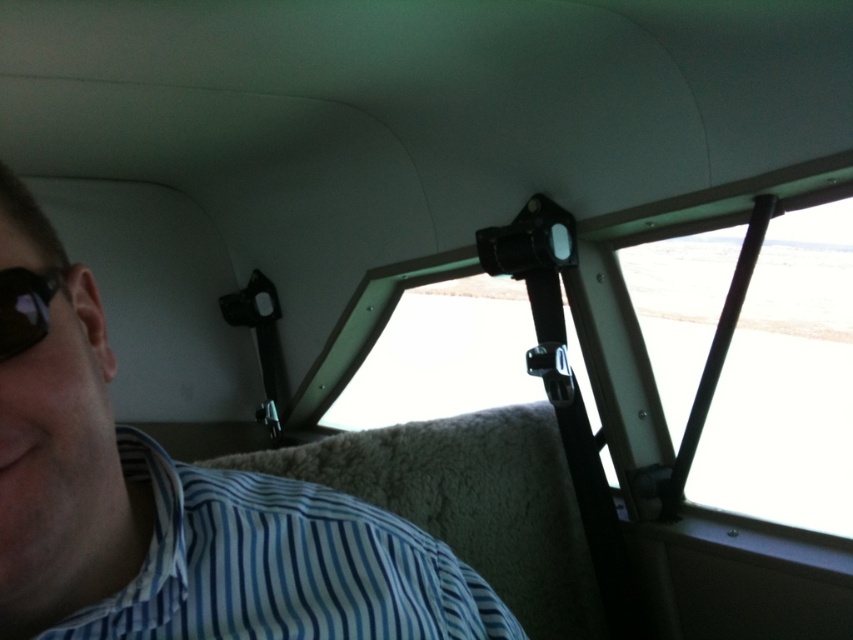
Question: Among these points, which one is nearest to the camera?

Choices:
 (A) (27, 340)
 (B) (347, 531)
 (C) (761, 445)

Answer: (A)

Question: Which object appears closest to the camera in this image?

Choices:
 (A) blue striped fabric shirt at lower left
 (B) transparent plastic window at upper center
 (C) black matte goggles at left
 (D) blue striped shirt at upper left

Answer: (D)

Question: From the image, what is the correct spatial relationship of blue striped shirt at upper left in relation to black matte goggles at left?

Choices:
 (A) above
 (B) below

Answer: (B)

Question: Which is nearer to the transparent plastic window at upper center?

Choices:
 (A) blue striped fabric shirt at lower left
 (B) blue striped shirt at upper left

Answer: (B)

Question: Is transparent plastic window at upper center positioned at the back of blue striped fabric shirt at lower left?

Choices:
 (A) no
 (B) yes

Answer: (B)

Question: Can you confirm if blue striped fabric shirt at lower left is thinner than black matte goggles at left?

Choices:
 (A) yes
 (B) no

Answer: (B)